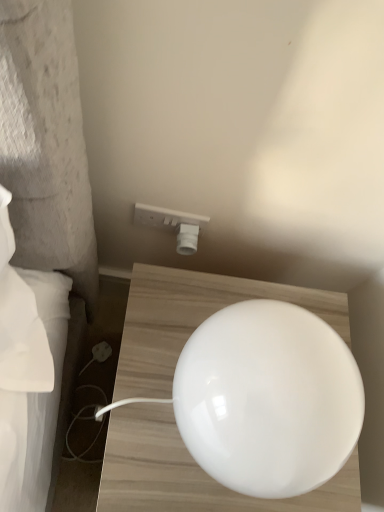
Find the location of a particular element. This screenshot has height=512, width=384. white plastic electrical outlet at upper center is located at coordinates (173, 225).

The height and width of the screenshot is (512, 384). What do you see at coordinates (173, 225) in the screenshot?
I see `white plastic electrical outlet at upper center` at bounding box center [173, 225].

What is the approximate height of white plastic electrical outlet at upper center?

It is 4.16 inches.

In order to face white plastic electrical outlet at upper center, should I rotate leftwards or rightwards?

It's best to rotate left around 2.464 degrees.

Measure the distance between point (187, 239) and camera.

They are 32.95 inches apart.

What is the approximate width of white glossy lampshade at center?

white glossy lampshade at center is 9.58 inches in width.

Image resolution: width=384 pixels, height=512 pixels. Describe the element at coordinates (268, 399) in the screenshot. I see `white glossy lampshade at center` at that location.

Find the location of `white glossy lampshade at center`. white glossy lampshade at center is located at coordinates (268, 399).

Locate an element on the screen. white plastic electrical outlet at upper center is located at coordinates (173, 225).

Considering the positions of objects white plastic electrical outlet at upper center and white glossy lampshade at center in the image provided, who is more to the right, white plastic electrical outlet at upper center or white glossy lampshade at center?

Positioned to the right is white glossy lampshade at center.

Which object is closer to the camera, white plastic electrical outlet at upper center or white glossy lampshade at center?

white glossy lampshade at center is closer to the camera.

Is point (142, 206) closer to camera compared to point (317, 329)?

No, (142, 206) is further to viewer.

From the image's perspective, is white plastic electrical outlet at upper center located beneath white glossy lampshade at center?

No.

From a real-world perspective, does white plastic electrical outlet at upper center stand above white glossy lampshade at center?

No, from a real-world perspective, white plastic electrical outlet at upper center is not above white glossy lampshade at center.

Which object is thinner, white plastic electrical outlet at upper center or white glossy lampshade at center?

With smaller width is white plastic electrical outlet at upper center.

Can you confirm if white plastic electrical outlet at upper center is taller than white glossy lampshade at center?

No.

Who is bigger, white plastic electrical outlet at upper center or white glossy lampshade at center?

Bigger between the two is white glossy lampshade at center.

From the picture: Would you say white plastic electrical outlet at upper center is outside white glossy lampshade at center?

Yes, white plastic electrical outlet at upper center is outside of white glossy lampshade at center.

Is white plastic electrical outlet at upper center touching white glossy lampshade at center?

No, white plastic electrical outlet at upper center is not touching white glossy lampshade at center.

Is white plastic electrical outlet at upper center positioned with its back to white glossy lampshade at center?

No, white plastic electrical outlet at upper center is not facing away from white glossy lampshade at center.

Based on the photo, measure the distance between white plastic electrical outlet at upper center and white glossy lampshade at center.

white plastic electrical outlet at upper center is 15.46 inches from white glossy lampshade at center.

The width and height of the screenshot is (384, 512). I want to click on electric outlet directly beneath the white glossy lampshade at center (from a real-world perspective), so click(x=173, y=225).

Consider the image. Considering the relative positions of white glossy lampshade at center and white plastic electrical outlet at upper center in the image provided, is white glossy lampshade at center to the right of white plastic electrical outlet at upper center from the viewer's perspective?

Indeed, white glossy lampshade at center is positioned on the right side of white plastic electrical outlet at upper center.

Based on the photo, is the position of white glossy lampshade at center less distant than that of white plastic electrical outlet at upper center?

Yes, it is in front of white plastic electrical outlet at upper center.

Is point (231, 326) closer or farther from the camera than point (189, 220)?

Point (231, 326) is closer to the camera than point (189, 220).

From the image's perspective, is white glossy lampshade at center located above white plastic electrical outlet at upper center?

Actually, white glossy lampshade at center appears below white plastic electrical outlet at upper center in the image.

From a real-world perspective, who is located lower, white glossy lampshade at center or white plastic electrical outlet at upper center?

From a 3D spatial view, white plastic electrical outlet at upper center is below.

Which of these two, white glossy lampshade at center or white plastic electrical outlet at upper center, is thinner?

white plastic electrical outlet at upper center is thinner.

Which of these two, white glossy lampshade at center or white plastic electrical outlet at upper center, stands taller?

Standing taller between the two is white glossy lampshade at center.

Considering the sizes of objects white glossy lampshade at center and white plastic electrical outlet at upper center in the image provided, who is bigger, white glossy lampshade at center or white plastic electrical outlet at upper center?

Bigger between the two is white glossy lampshade at center.

Is white glossy lampshade at center located outside white plastic electrical outlet at upper center?

white glossy lampshade at center is positioned outside white plastic electrical outlet at upper center.

In the scene shown: Is white glossy lampshade at center positioned far away from white plastic electrical outlet at upper center?

No, white glossy lampshade at center is not far from white plastic electrical outlet at upper center.

Is white glossy lampshade at center aimed at white plastic electrical outlet at upper center?

No, white glossy lampshade at center is not oriented towards white plastic electrical outlet at upper center.

Can you tell me how much white glossy lampshade at center and white plastic electrical outlet at upper center differ in facing direction?

0.728 degrees.

I want to click on electric outlet on the left of white glossy lampshade at center, so click(173, 225).

Where is `lamp below the white plastic electrical outlet at upper center (from the image's perspective)`? This screenshot has height=512, width=384. lamp below the white plastic electrical outlet at upper center (from the image's perspective) is located at coordinates tap(268, 399).

Find the location of a particular element. lamp lying on the right of white plastic electrical outlet at upper center is located at coordinates (268, 399).